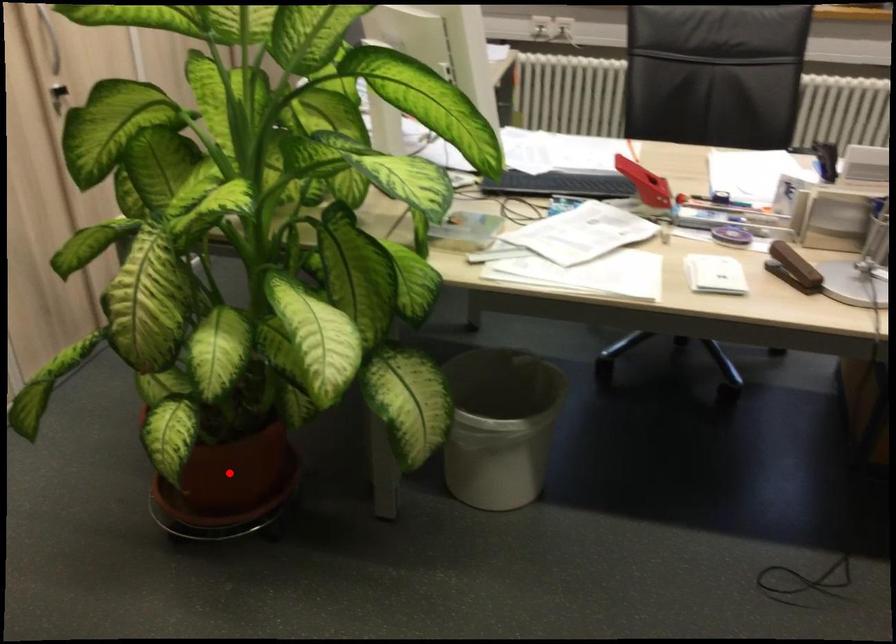
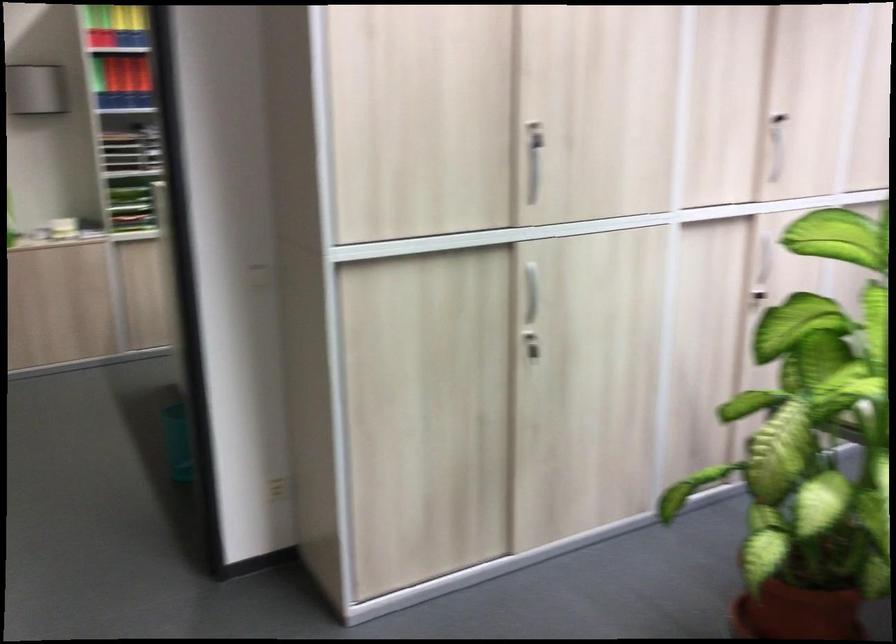
In the second image, find the point that corresponds to the highlighted location in the first image.

(797, 612)